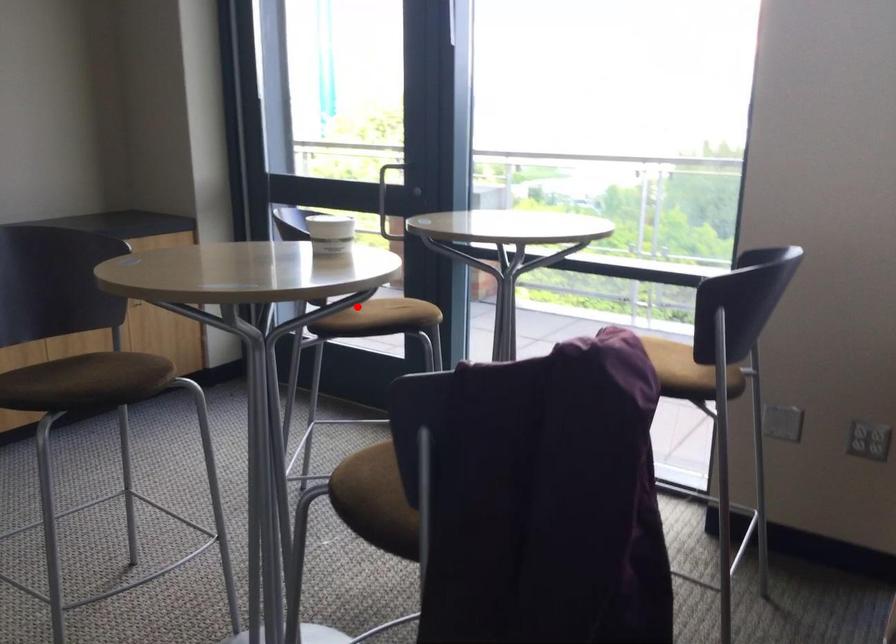
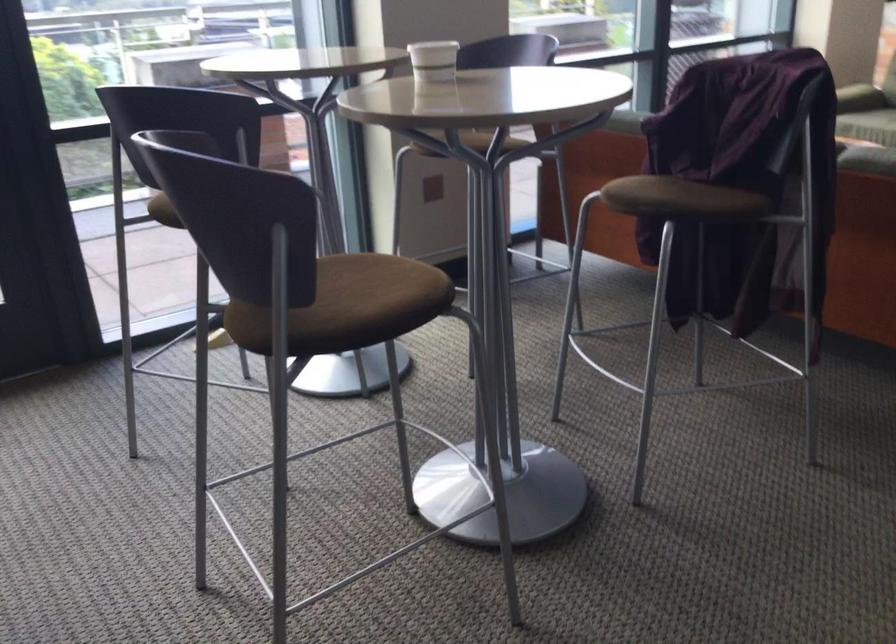
Question: I am providing you with two images of the same scene from different viewpoints. Image1 has a red point marked. In image2, the corresponding 3D location appears at what relative position? Reply with the corresponding letter.

Choices:
 (A) Closer
 (B) Farther

Answer: (A)